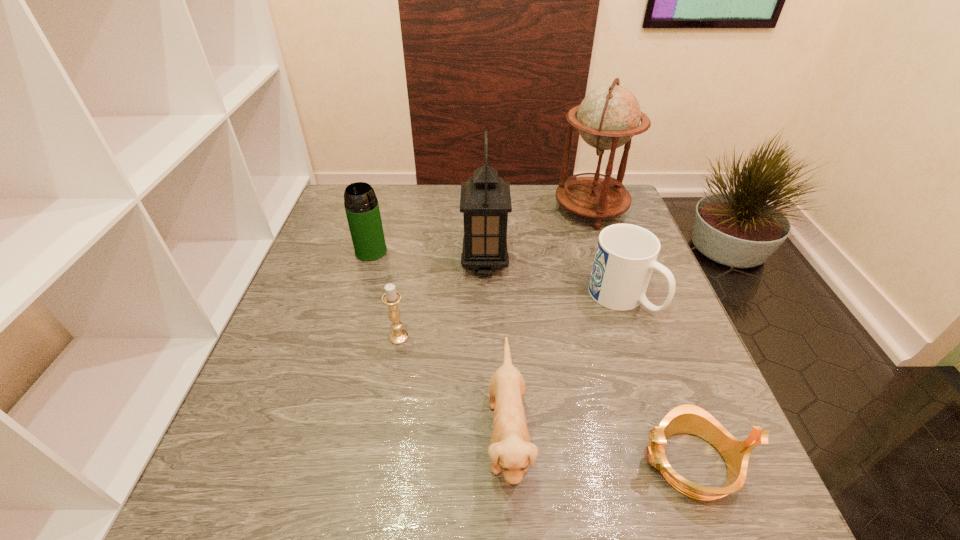
The image size is (960, 540). I want to click on free space that satisfies the following two spatial constraints: 1. on the surface of the globe; 2. from the spout of the fifth shortest object, so click(x=605, y=252).

Where is `free space that satisfies the following two spatial constraints: 1. on the surface of the mug; 2. on the left side of the globe`? This screenshot has height=540, width=960. free space that satisfies the following two spatial constraints: 1. on the surface of the mug; 2. on the left side of the globe is located at coordinates (620, 298).

This screenshot has height=540, width=960. What are the coordinates of `vacant area that satisfies the following two spatial constraints: 1. from the spout of the mug; 2. on the right side of the third tallest object` in the screenshot? It's located at (357, 298).